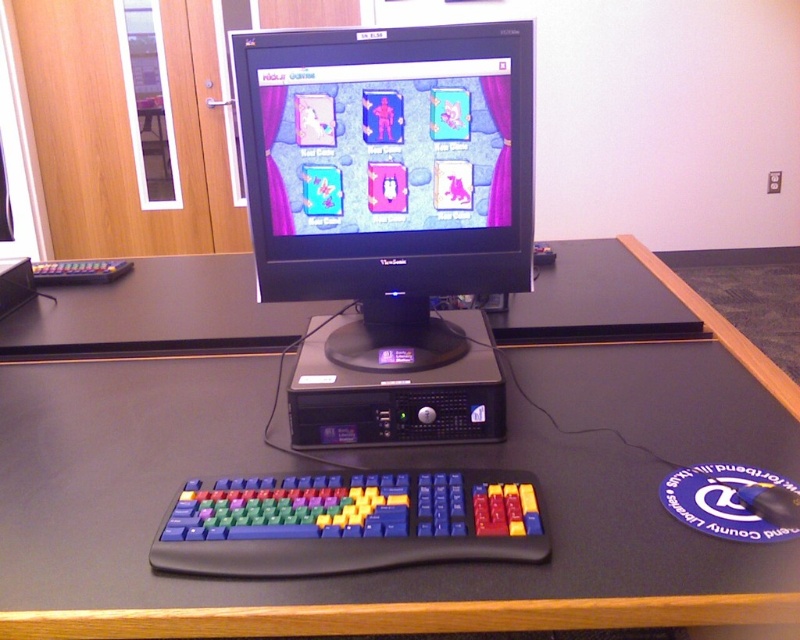
You are a technician trying to determine if the black plastic desktop computer at center and the multicolored plastic keyboard at lower center can fit into a storage box that is 15 cm in height. Based on their heights, which one might not fit?

The black plastic desktop computer at center is much taller than the multicolored plastic keyboard at lower center, so the black plastic desktop computer at center might not fit into the storage box that is 15 cm in height.

You are setting up a new desk organizer that requires knowing the width of the objects. Which object is wider, the black plastic computer tower at center or the black matte mouse at lower right?

The black plastic computer tower at center is wider than the black matte mouse at lower right according to the description.

You are setting up a new desk and want to place the black plastic desktop computer at center and the multicolored plastic keyboard at lower center. If you have a shelf that can only hold items up to 10 cm in thickness, which item might not fit based on their thickness?

The multicolored plastic keyboard at lower center might not fit on the shelf because it is thicker than the black plastic desktop computer at center, and the shelf has a 10 cm thickness limit.